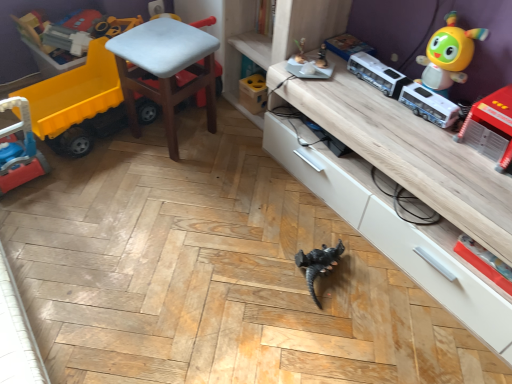
Identify the location of free space in front of shiny yellow toy at upper right, the second toy viewed from the right. This screenshot has width=512, height=384. (424, 128).